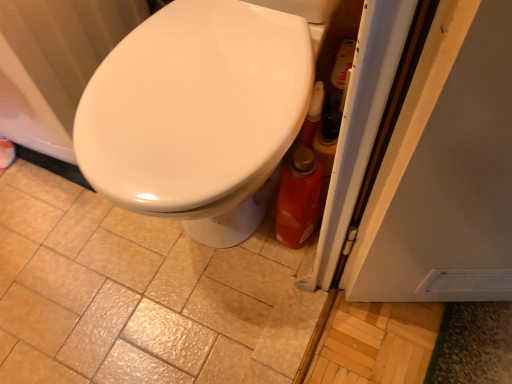
Question: Would you say white glossy radiator at upper left is inside or outside matte ceramic tile at center?

Choices:
 (A) outside
 (B) inside

Answer: (A)

Question: From their relative heights in the image, would you say white glossy radiator at upper left is taller or shorter than matte ceramic tile at center?

Choices:
 (A) tall
 (B) short

Answer: (A)

Question: Which object is positioned closest to the white glossy radiator at upper left?

Choices:
 (A) white glossy bidet at center
 (B) matte ceramic tile at center

Answer: (A)

Question: Based on their relative distances, which object is nearer to the matte ceramic tile at center?

Choices:
 (A) white glossy bidet at center
 (B) white glossy radiator at upper left

Answer: (B)